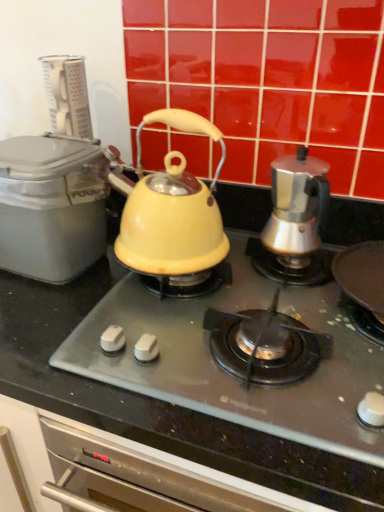
At what (x,y) coordinates should I click in order to perform the action: click on matte gray container at left. Please return your answer as a coordinate pair (x, y). The image size is (384, 512). Looking at the image, I should click on (50, 207).

What is the approximate height of matte yellow kettle at center?

3.54 inches.

This screenshot has width=384, height=512. What are the coordinates of `satin silver coffee maker at right, which is the 2th kettle from left to right` in the screenshot? It's located at (297, 204).

How much space does matte yellow kettle at center, acting as the first kettle starting from the left, occupy horizontally?

7.00 inches.

Locate an element on the screen. The width and height of the screenshot is (384, 512). matte gray container at left is located at coordinates (50, 207).

Locate an element on the screen. The image size is (384, 512). kettle on the right side of matte yellow kettle at center, the 2th kettle positioned from the right is located at coordinates (297, 204).

Is matte yellow kettle at center, acting as the first kettle starting from the left, looking in the opposite direction of satin silver coffee maker at right, which is the first kettle in right-to-left order?

No, matte yellow kettle at center, acting as the first kettle starting from the left, is not facing the opposite direction of satin silver coffee maker at right, which is the first kettle in right-to-left order.

Does matte yellow kettle at center, acting as the first kettle starting from the left, have a larger size compared to satin silver coffee maker at right, which is the first kettle in right-to-left order?

Yes.

Is matte yellow kettle at center, the 2th kettle positioned from the right, thinner than satin silver coffee maker at right, which is the first kettle in right-to-left order?

No.

From a real-world perspective, is satin silver coffee maker at right, which is the 2th kettle from left to right, above or below matte yellow kettle at center, the 2th kettle positioned from the right?

satin silver coffee maker at right, which is the 2th kettle from left to right, is below matte yellow kettle at center, the 2th kettle positioned from the right.

Between satin silver coffee maker at right, which is the 2th kettle from left to right, and matte yellow kettle at center, the 2th kettle positioned from the right, which one has smaller size?

Smaller between the two is satin silver coffee maker at right, which is the 2th kettle from left to right.

From the image's perspective, is satin silver coffee maker at right, which is the first kettle in right-to-left order, above matte yellow kettle at center, acting as the first kettle starting from the left?

Incorrect, from the image's perspective, satin silver coffee maker at right, which is the first kettle in right-to-left order, is lower than matte yellow kettle at center, acting as the first kettle starting from the left.

Considering the sizes of satin silver coffee maker at right, which is the 2th kettle from left to right, and matte yellow kettle at center, the 2th kettle positioned from the right, in the image, is satin silver coffee maker at right, which is the 2th kettle from left to right, wider or thinner than matte yellow kettle at center, the 2th kettle positioned from the right,?

satin silver coffee maker at right, which is the 2th kettle from left to right, is thinner than matte yellow kettle at center, the 2th kettle positioned from the right.

From the image's perspective, is matte yellow kettle at center beneath satin silver coffee maker at right, which is the 2th kettle from left to right?

Correct, matte yellow kettle at center appears lower than satin silver coffee maker at right, which is the 2th kettle from left to right, in the image.

Does matte yellow kettle at center have a smaller size compared to satin silver coffee maker at right, which is the 2th kettle from left to right?

Actually, matte yellow kettle at center might be larger than satin silver coffee maker at right, which is the 2th kettle from left to right.

Could you tell me if matte yellow kettle at center is turned towards satin silver coffee maker at right, which is the first kettle in right-to-left order?

No, matte yellow kettle at center is not oriented towards satin silver coffee maker at right, which is the first kettle in right-to-left order.

Between matte gray container at left and matte yellow kettle at center, which one is positioned behind?

matte gray container at left.

From the image's perspective, between matte gray container at left and matte yellow kettle at center, who is located below?

matte yellow kettle at center.

Is matte yellow kettle at center to the left or to the right of matte yellow kettle at center, acting as the first kettle starting from the left, in the image?

Clearly, matte yellow kettle at center is on the right of matte yellow kettle at center, acting as the first kettle starting from the left, in the image.

Is matte yellow kettle at center bigger than matte yellow kettle at center, acting as the first kettle starting from the left?

Indeed, matte yellow kettle at center has a larger size compared to matte yellow kettle at center, acting as the first kettle starting from the left.

From the image's perspective, is matte yellow kettle at center below matte yellow kettle at center, the 2th kettle positioned from the right?

Yes, from the image's perspective, matte yellow kettle at center is beneath matte yellow kettle at center, the 2th kettle positioned from the right.

Considering the sizes of objects satin silver coffee maker at right, which is the 2th kettle from left to right, and matte yellow kettle at center in the image provided, who is wider, satin silver coffee maker at right, which is the 2th kettle from left to right, or matte yellow kettle at center?

matte yellow kettle at center.

Considering the sizes of satin silver coffee maker at right, which is the 2th kettle from left to right, and matte yellow kettle at center in the image, is satin silver coffee maker at right, which is the 2th kettle from left to right, bigger or smaller than matte yellow kettle at center?

Clearly, satin silver coffee maker at right, which is the 2th kettle from left to right, is smaller in size than matte yellow kettle at center.

How many degrees apart are the facing directions of satin silver coffee maker at right, which is the first kettle in right-to-left order, and matte yellow kettle at center?

satin silver coffee maker at right, which is the first kettle in right-to-left order, and matte yellow kettle at center are facing 0.00347 degrees away from each other.

Is point (286, 197) closer or farther from the camera than point (75, 344)?

Clearly, point (286, 197) is more distant from the camera than point (75, 344).

Between matte gray container at left and satin silver coffee maker at right, which is the first kettle in right-to-left order, which one is positioned behind?

satin silver coffee maker at right, which is the first kettle in right-to-left order.

Is matte gray container at left to the left or to the right of satin silver coffee maker at right, which is the first kettle in right-to-left order, in the image?

From the image, it's evident that matte gray container at left is to the left of satin silver coffee maker at right, which is the first kettle in right-to-left order.

Could you tell me if matte gray container at left is turned towards satin silver coffee maker at right, which is the 2th kettle from left to right?

No, matte gray container at left does not turn towards satin silver coffee maker at right, which is the 2th kettle from left to right.

Would you say matte gray container at left is inside or outside satin silver coffee maker at right, which is the first kettle in right-to-left order?

matte gray container at left lies outside satin silver coffee maker at right, which is the first kettle in right-to-left order.

What are the coordinates of `kettle that is above the satin silver coffee maker at right, which is the first kettle in right-to-left order (from a real-world perspective)` in the screenshot? It's located at (171, 209).

Identify the location of kettle on the right of matte yellow kettle at center, acting as the first kettle starting from the left. coord(297,204).

Considering their positions, is matte gray container at left positioned closer to satin silver coffee maker at right, which is the first kettle in right-to-left order, than matte yellow kettle at center, the 2th kettle positioned from the right?

matte yellow kettle at center, the 2th kettle positioned from the right, is positioned closer to the anchor satin silver coffee maker at right, which is the first kettle in right-to-left order.

From the image, which object appears to be nearer to matte yellow kettle at center, the 2th kettle positioned from the right, matte gray container at left or satin silver coffee maker at right, which is the 2th kettle from left to right?

matte gray container at left is closer to matte yellow kettle at center, the 2th kettle positioned from the right.

From the image, which object appears to be nearer to matte yellow kettle at center, matte yellow kettle at center, the 2th kettle positioned from the right, or satin silver coffee maker at right, which is the 2th kettle from left to right?

The object closer to matte yellow kettle at center is matte yellow kettle at center, the 2th kettle positioned from the right.

From the image, which object appears to be nearer to matte yellow kettle at center, matte gray container at left or satin silver coffee maker at right, which is the first kettle in right-to-left order?

satin silver coffee maker at right, which is the first kettle in right-to-left order.

Based on their spatial positions, is matte gray container at left or matte yellow kettle at center, acting as the first kettle starting from the left, closer to matte yellow kettle at center?

The object closer to matte yellow kettle at center is matte yellow kettle at center, acting as the first kettle starting from the left.

When comparing their distances from matte yellow kettle at center, acting as the first kettle starting from the left, does satin silver coffee maker at right, which is the 2th kettle from left to right, or matte yellow kettle at center seem further?

Among the two, satin silver coffee maker at right, which is the 2th kettle from left to right, is located further to matte yellow kettle at center, acting as the first kettle starting from the left.

When comparing their distances from matte gray container at left, does matte yellow kettle at center or satin silver coffee maker at right, which is the 2th kettle from left to right, seem further?

satin silver coffee maker at right, which is the 2th kettle from left to right, is further to matte gray container at left.

Considering their positions, is matte yellow kettle at center, the 2th kettle positioned from the right, positioned closer to matte yellow kettle at center than matte gray container at left?

The object closer to matte yellow kettle at center is matte yellow kettle at center, the 2th kettle positioned from the right.

At what (x,y) coordinates should I click in order to perform the action: click on gas stove between matte gray container at left and satin silver coffee maker at right, which is the first kettle in right-to-left order. Please return your answer as a coordinate pair (x, y). The image size is (384, 512). Looking at the image, I should click on (230, 376).

Image resolution: width=384 pixels, height=512 pixels. I want to click on kettle between matte gray container at left and matte yellow kettle at center, so click(x=171, y=209).

Identify the location of kettle between matte gray container at left and satin silver coffee maker at right, which is the 2th kettle from left to right, in the horizontal direction. point(171,209).

Where is `gas stove between matte yellow kettle at center, acting as the first kettle starting from the left, and satin silver coffee maker at right, which is the first kettle in right-to-left order`? Image resolution: width=384 pixels, height=512 pixels. gas stove between matte yellow kettle at center, acting as the first kettle starting from the left, and satin silver coffee maker at right, which is the first kettle in right-to-left order is located at coordinates (230, 376).